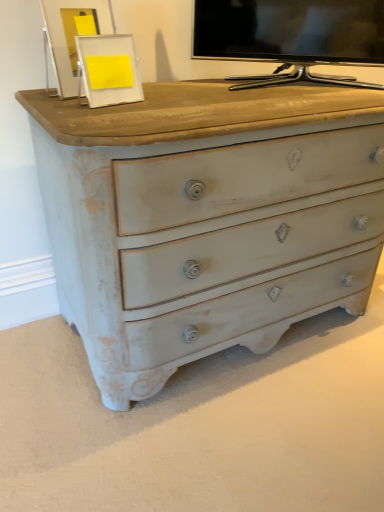
Question: Is the position of matte black tv at upper center less distant than that of white matte picture frame at upper center?

Choices:
 (A) yes
 (B) no

Answer: (B)

Question: Can you confirm if matte black tv at upper center is positioned to the left of white matte picture frame at upper center?

Choices:
 (A) no
 (B) yes

Answer: (A)

Question: From a real-world perspective, is matte black tv at upper center located beneath white matte picture frame at upper center?

Choices:
 (A) yes
 (B) no

Answer: (B)

Question: Is matte black tv at upper center to the right of white matte picture frame at upper center from the viewer's perspective?

Choices:
 (A) yes
 (B) no

Answer: (A)

Question: Can you confirm if matte black tv at upper center is taller than white matte picture frame at upper center?

Choices:
 (A) yes
 (B) no

Answer: (A)

Question: Is matte black tv at upper center in contact with white matte picture frame at upper center?

Choices:
 (A) no
 (B) yes

Answer: (A)

Question: Is white matte picture frame at upper center looking in the opposite direction of matte black tv at upper center?

Choices:
 (A) yes
 (B) no

Answer: (B)

Question: Does white matte picture frame at upper center have a lesser width compared to matte black tv at upper center?

Choices:
 (A) no
 (B) yes

Answer: (B)

Question: Is white matte picture frame at upper center bigger than matte black tv at upper center?

Choices:
 (A) yes
 (B) no

Answer: (B)

Question: Is white matte picture frame at upper center placed right next to matte black tv at upper center?

Choices:
 (A) no
 (B) yes

Answer: (A)

Question: Does white matte picture frame at upper center have a smaller size compared to matte black tv at upper center?

Choices:
 (A) yes
 (B) no

Answer: (A)

Question: Can you confirm if white matte picture frame at upper center is wider than matte black tv at upper center?

Choices:
 (A) yes
 (B) no

Answer: (B)

Question: In the image, is matte black tv at upper center positioned in front of or behind white matte picture frame at upper center?

Choices:
 (A) front
 (B) behind

Answer: (B)